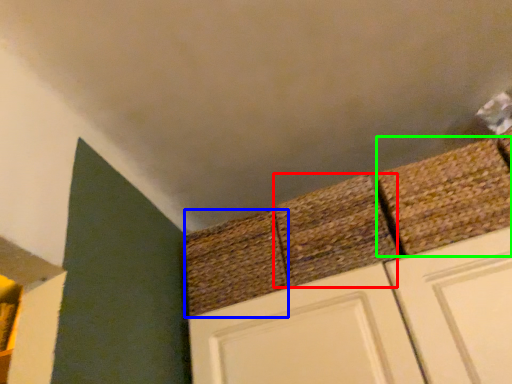
Question: Which is farther away from brick (highlighted by a red box)? brick (highlighted by a blue box) or brick (highlighted by a green box)?

Choices:
 (A) brick
 (B) brick

Answer: (B)